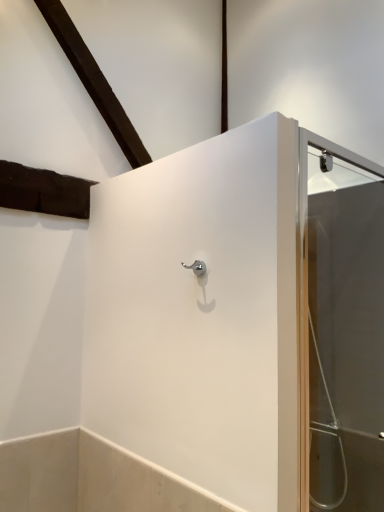
Describe the element at coordinates (341, 328) in the screenshot. I see `clear glass screen door at right` at that location.

Find the location of a particular element. Image resolution: width=384 pixels, height=512 pixels. clear glass screen door at right is located at coordinates (341, 328).

At what (x,y) coordinates should I click in order to perform the action: click on clear glass screen door at right. Please return your answer as a coordinate pair (x, y). Looking at the image, I should click on (341, 328).